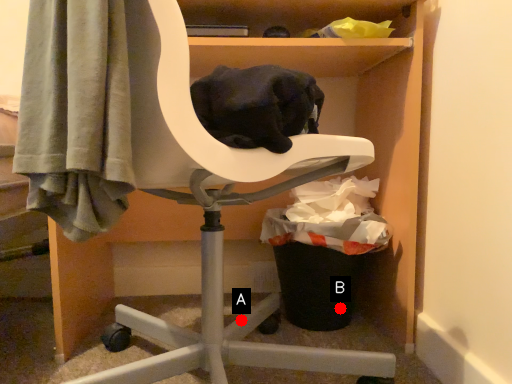
Question: Two points are circled on the image, labeled by A and B beside each circle. Which of the following is the farthest from the observer?

Choices:
 (A) A is further
 (B) B is further

Answer: (B)